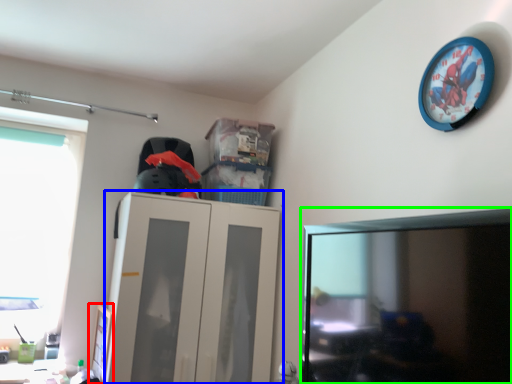
Question: Which object is positioned closest to picture frame (highlighted by a red box)? Select from cabinetry (highlighted by a blue box) and computer monitor (highlighted by a green box).

Choices:
 (A) cabinetry
 (B) computer monitor

Answer: (A)